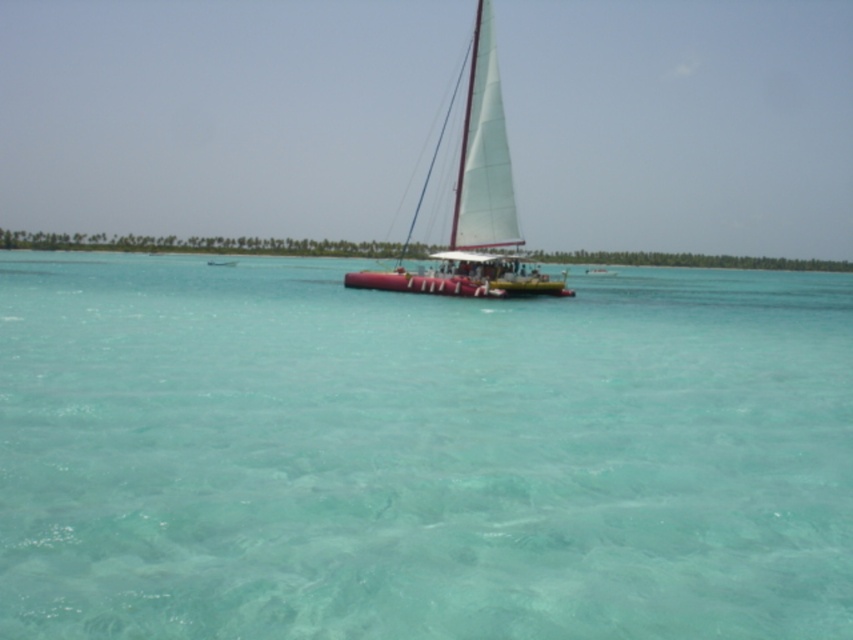
Question: Which of the following is the closest to the observer?

Choices:
 (A) clear water at center
 (B) white matte sailboat at center

Answer: (A)

Question: Is clear water at center thinner than white matte sailboat at center?

Choices:
 (A) no
 (B) yes

Answer: (A)

Question: Is clear water at center behind white matte sailboat at center?

Choices:
 (A) no
 (B) yes

Answer: (A)

Question: Can you confirm if clear water at center is positioned to the right of white matte sailboat at center?

Choices:
 (A) yes
 (B) no

Answer: (A)

Question: Which point appears closest to the camera in this image?

Choices:
 (A) (466, 250)
 (B) (384, 627)

Answer: (B)

Question: Which object is farther from the camera taking this photo?

Choices:
 (A) clear water at center
 (B) white matte sailboat at center

Answer: (B)